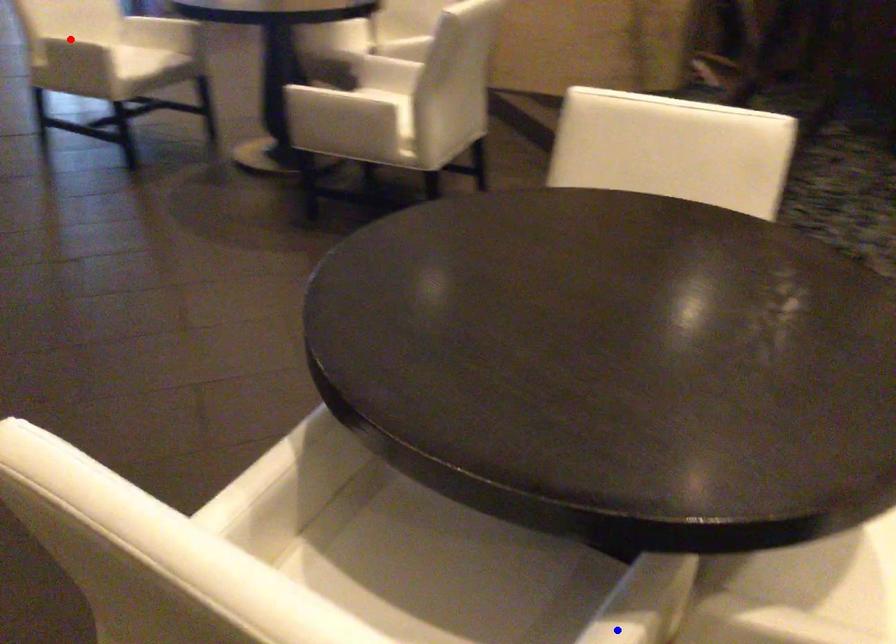
Question: Two points are marked on the image. Which point is closer to the camera?

Choices:
 (A) Blue point is closer.
 (B) Red point is closer.

Answer: (A)